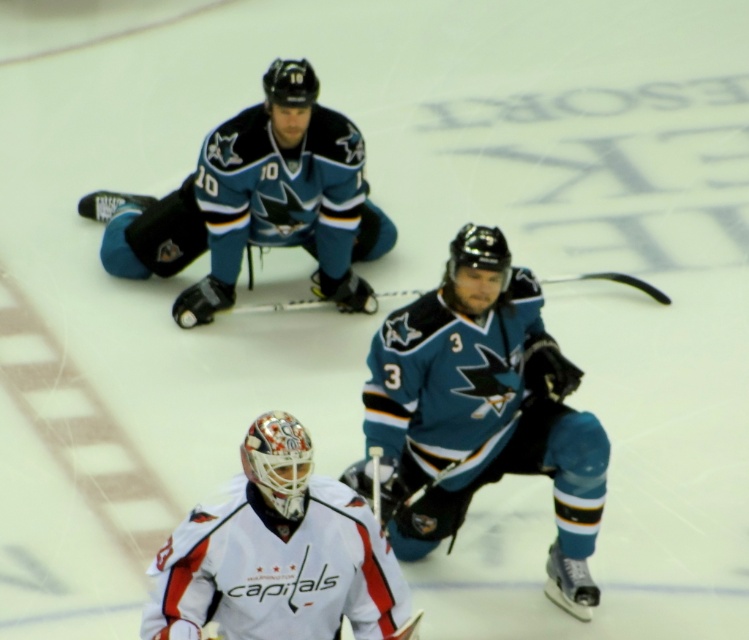
Question: Does teal jersey at center appear on the left side of black matte hockey stick at center?

Choices:
 (A) no
 (B) yes

Answer: (B)

Question: Which point is closer to the camera taking this photo?

Choices:
 (A) (466, 353)
 (B) (318, 508)

Answer: (B)

Question: Is teal jersey at upper center wider than white matte goalie mask at center?

Choices:
 (A) no
 (B) yes

Answer: (B)

Question: Can you confirm if white matte goalie mask at center is wider than black matte hockey stick at center?

Choices:
 (A) no
 (B) yes

Answer: (B)

Question: Which object is the closest to the black matte hockey stick at center?

Choices:
 (A) teal jersey at upper center
 (B) teal jersey at center
 (C) white matte goalie mask at center

Answer: (A)

Question: Estimate the real-world distances between objects in this image. Which object is farther from the black matte hockey stick at center?

Choices:
 (A) white matte goalie mask at center
 (B) teal jersey at upper center

Answer: (A)